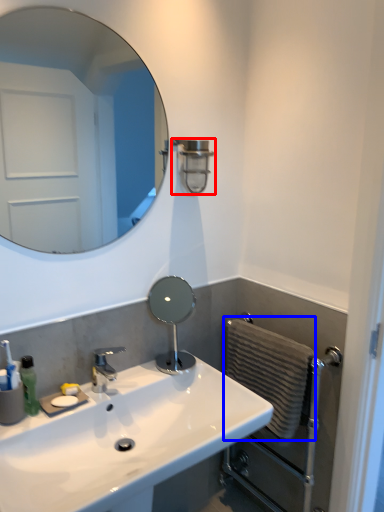
Question: Which object is closer to the camera taking this photo, shower (highlighted by a red box) or hand towel (highlighted by a blue box)?

Choices:
 (A) shower
 (B) hand towel

Answer: (B)